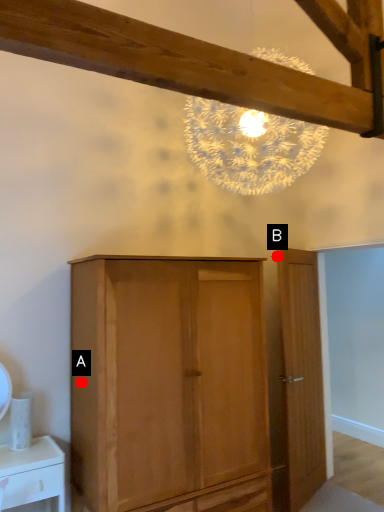
Question: Two points are circled on the image, labeled by A and B beside each circle. Which point is further to the camera?

Choices:
 (A) A is further
 (B) B is further

Answer: (B)